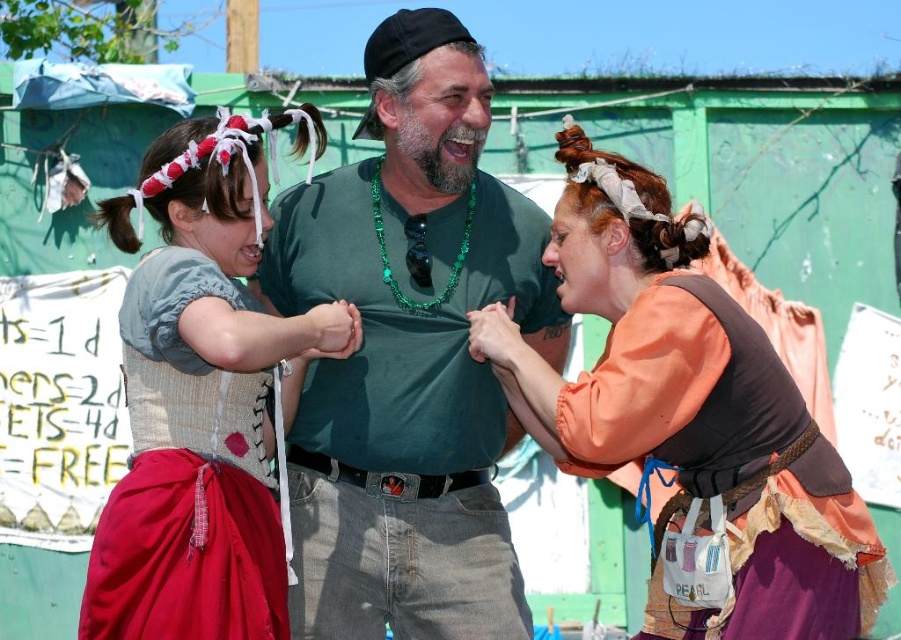
Question: Does green matte shirt at center appear on the right side of emerald green beaded necklace at center?

Choices:
 (A) yes
 (B) no

Answer: (B)

Question: Does green matte shirt at center have a larger size compared to matte gray vest at center?

Choices:
 (A) yes
 (B) no

Answer: (B)

Question: Estimate the real-world distances between objects in this image. Which object is closer to the green matte shirt at center?

Choices:
 (A) matte gray vest at center
 (B) orange fabric dress at center
 (C) emerald green beaded necklace at center

Answer: (C)

Question: Which point is closer to the camera?

Choices:
 (A) orange fabric dress at center
 (B) emerald green beaded necklace at center

Answer: (A)

Question: Where is green matte shirt at center located in relation to emerald green beaded necklace at center in the image?

Choices:
 (A) right
 (B) left

Answer: (B)

Question: Which point appears closest to the camera in this image?

Choices:
 (A) (177, 240)
 (B) (440, 602)
 (C) (416, 310)
 (D) (675, 404)

Answer: (D)